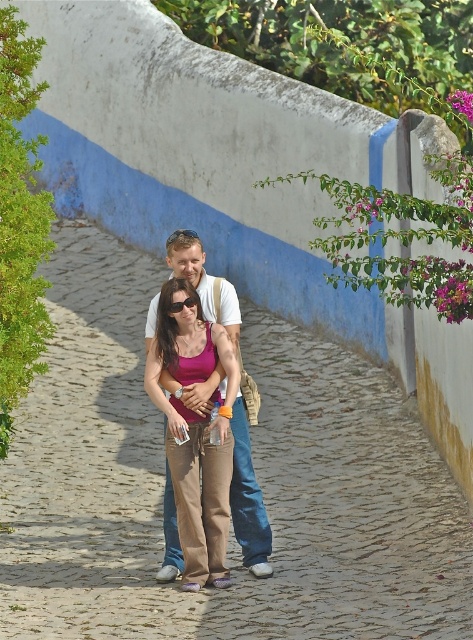
Question: Can you confirm if cobblestone path at center is positioned below white cotton shirt at center?

Choices:
 (A) no
 (B) yes

Answer: (A)

Question: Which of the following is the farthest from the observer?

Choices:
 (A) (231, 300)
 (B) (251, 324)

Answer: (B)

Question: Is cobblestone path at center to the right of white cotton shirt at center from the viewer's perspective?

Choices:
 (A) no
 (B) yes

Answer: (A)

Question: Can you confirm if cobblestone path at center is bigger than white cotton shirt at center?

Choices:
 (A) yes
 (B) no

Answer: (A)